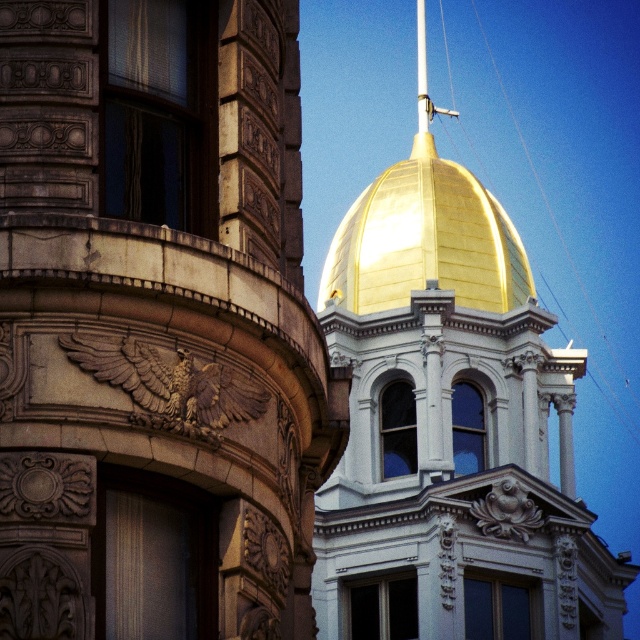
You are an architect examining the image. You need to locate the gold polished dome at upper center. What are its coordinates?

The gold polished dome at upper center is located at coordinates point (426, 241).

You are an architect assessing the two structures. Which object, the gold polished dome at upper center or the metallic pole at center, has a greater height?

The metallic pole at center is taller than the gold polished dome at upper center.